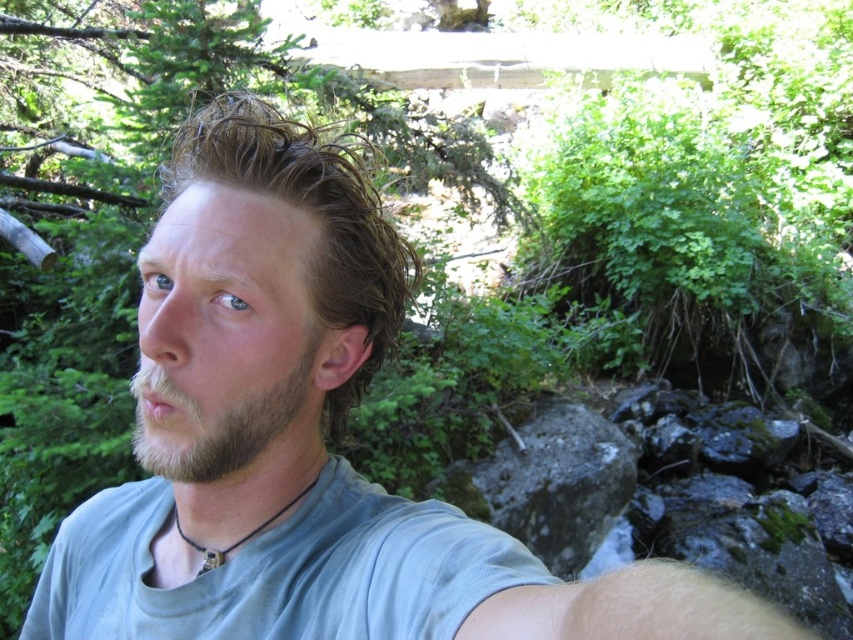
Can you confirm if brown fuzzy hair at center is positioned to the right of brown fuzzy beard at lower left?

In fact, brown fuzzy hair at center is to the left of brown fuzzy beard at lower left.

Is point (352, 372) closer to camera compared to point (178, 442)?

No, (352, 372) is behind (178, 442).

The image size is (853, 640). I want to click on brown fuzzy hair at center, so click(312, 218).